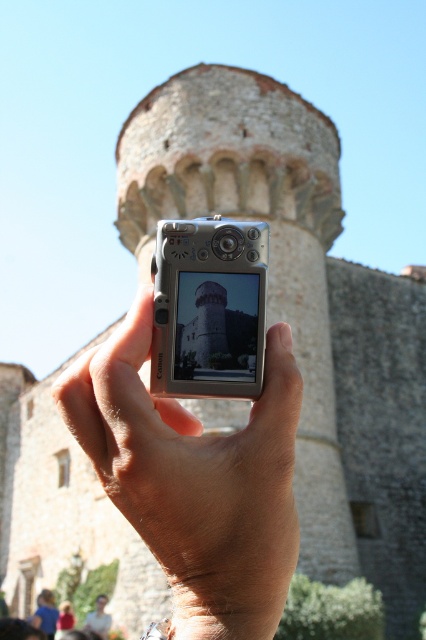
Question: Can you confirm if smooth skin hand at center is positioned to the left of silver metallic camera at center?

Choices:
 (A) no
 (B) yes

Answer: (B)

Question: Does smooth skin hand at center appear under silver metallic camera at center?

Choices:
 (A) no
 (B) yes

Answer: (B)

Question: Observing the image, what is the correct spatial positioning of smooth skin hand at center in reference to silver metallic camera at center?

Choices:
 (A) above
 (B) below

Answer: (B)

Question: Which point is closer to the camera?

Choices:
 (A) silver metallic camera at center
 (B) smooth skin hand at center

Answer: (B)

Question: Among these objects, which one is farthest from the camera?

Choices:
 (A) silver metallic camera at center
 (B) smooth skin hand at center

Answer: (A)